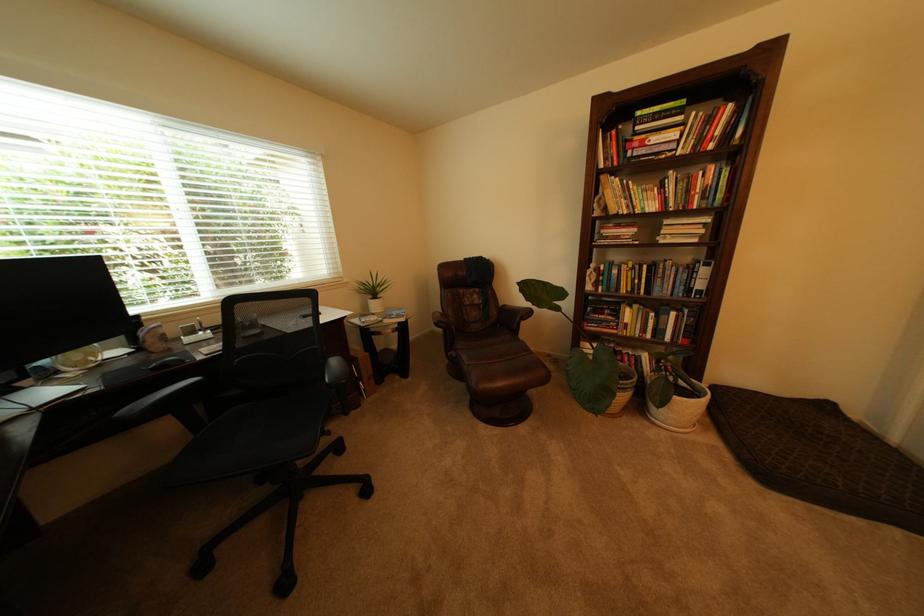
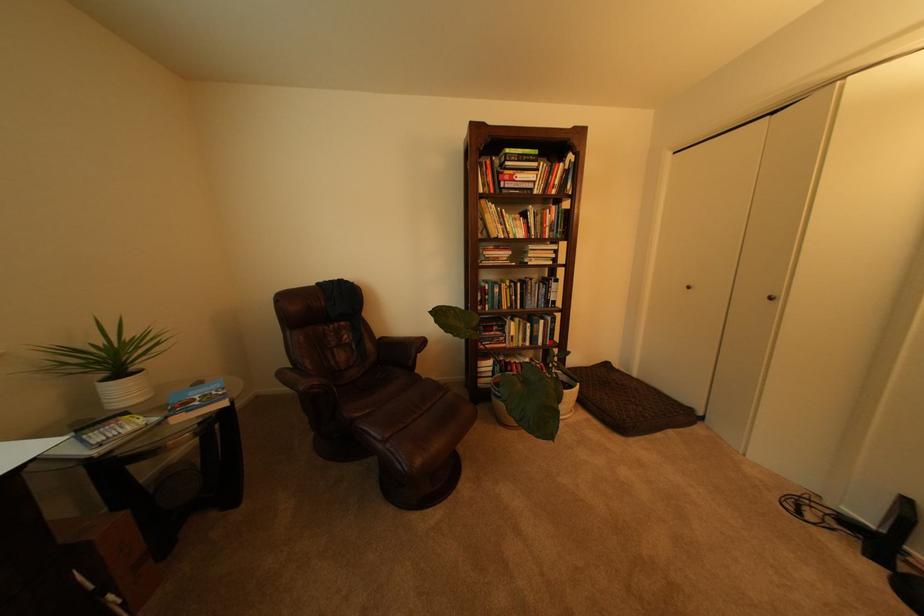
Where in the second image is the point corresponding to point 390,297 from the first image?

(143, 370)